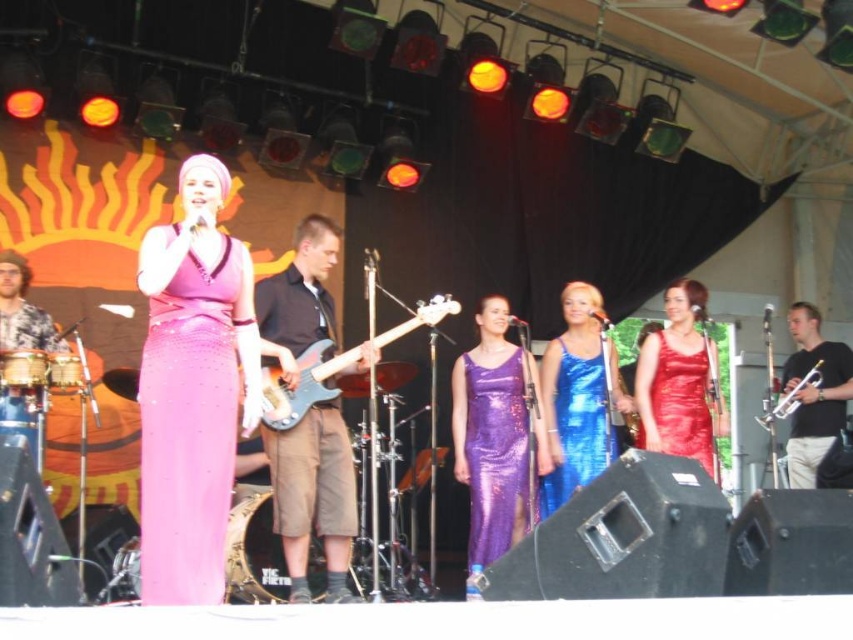
You are a photographer positioned in front of the stage. You need to capture a photo that includes both the black matte trumpet at right and the shiny blue dress at center. Based on their positions, which object should you adjust your camera angle to focus on first to ensure both are in frame?

The black matte trumpet at right is located above the shiny blue dress at center, so you should adjust your camera angle to focus on the black matte trumpet at right first to ensure both are in frame.

You are a stagehand adjusting the lighting for the performance. You need to position a spotlight so it can illuminate both the point at [306,502] and the point at [804,374]. Given that the spotlight can only focus on one point at a time, which point should you aim the spotlight at first to ensure the closer one is lit before the farther one?

You should aim the spotlight at point [306,502] first because it is in front of point [804,374], making it closer to the stagehand. This ensures the closer point is illuminated before the farther one.